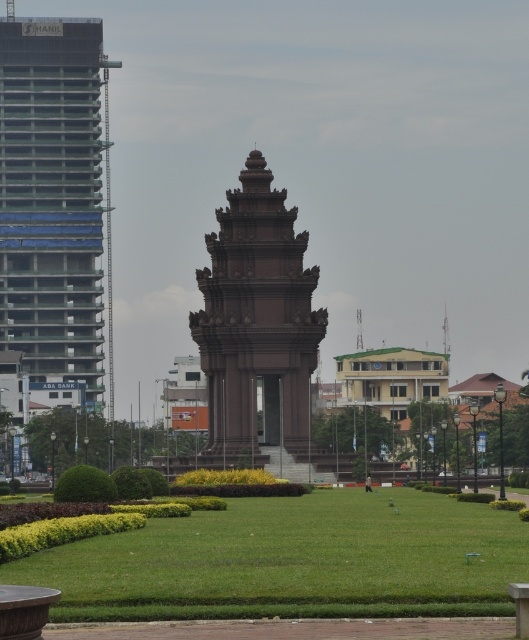
Looking at this image, you are a visitor standing on the paved walkway near the monument. You want to take a photo of the brown stone tower at center without any obstructions. Is the green grass at center blocking your view of the tower?

The green grass at center is in front of the brown stone tower at center, so it may block your view of the tower. Move closer to the tower or adjust your angle to avoid the grass.

You are standing at the monument and looking towards the point labeled as point (293, 561). What do you see at that location?

At point (293, 561), you see green grass at center.

You are standing at the entrance of the park and want to reach the monument. There is a green grass area at the center. Can you walk directly towards the monument from the entrance without stepping on the green grass at center?

The green grass at center is located at point (293, 561), which is in the center of the image. Since the paved walkway is in the foreground leading to the monument, you can walk directly towards the monument from the entrance without stepping on the green grass at center by following the paved path.